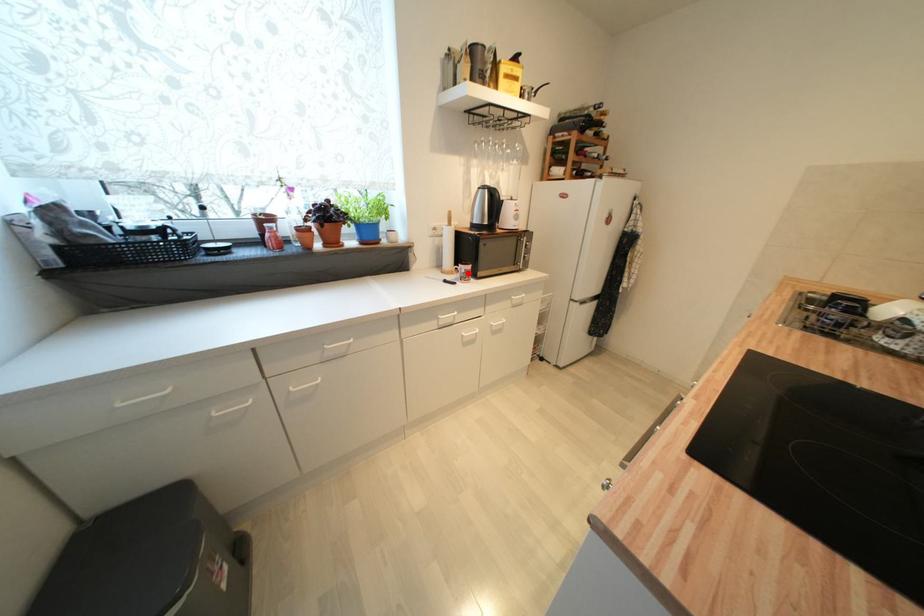
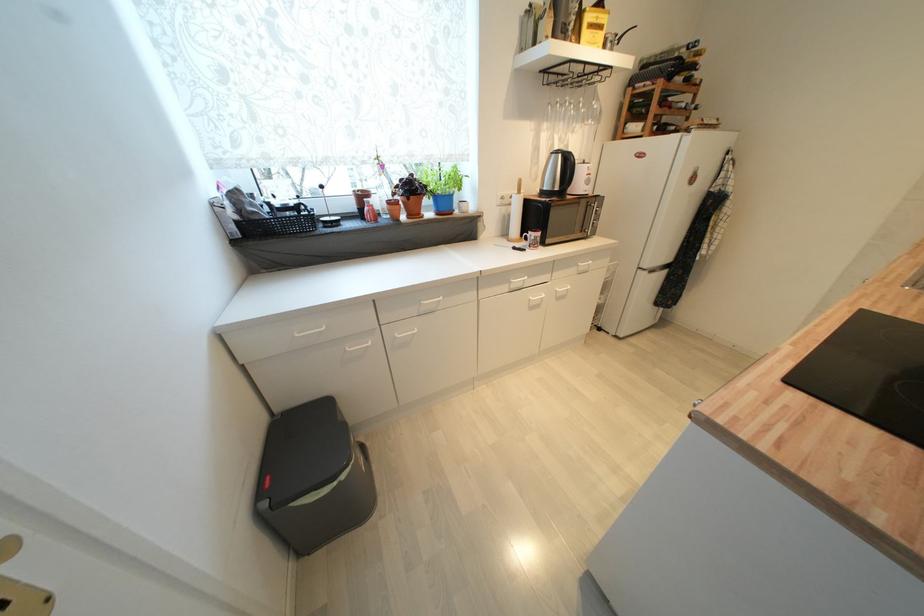
Question: I am providing you with two images of the same scene from different viewpoints. A red point is marked on the first image. Can you still see the location of the red point in image 2?

Choices:
 (A) Yes
 (B) No

Answer: (A)